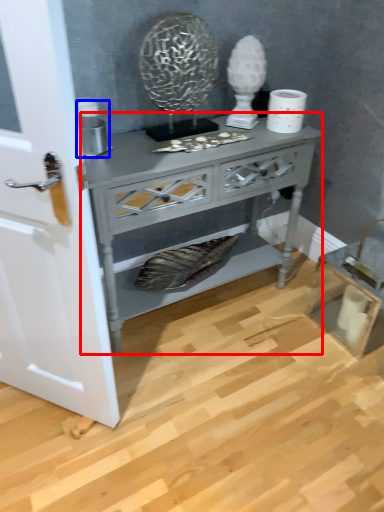
Question: Which point is closer to the camera, nightstand (highlighted by a red box) or appliance (highlighted by a blue box)?

Choices:
 (A) nightstand
 (B) appliance

Answer: (A)